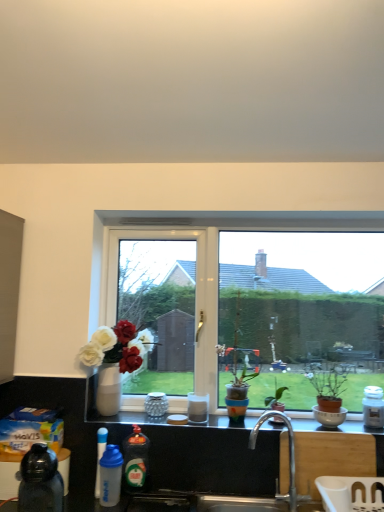
The image size is (384, 512). I want to click on vacant area situated below multicolored terracotta pot at center, the first houseplant when ordered from left to right (from a real-world perspective), so click(236, 428).